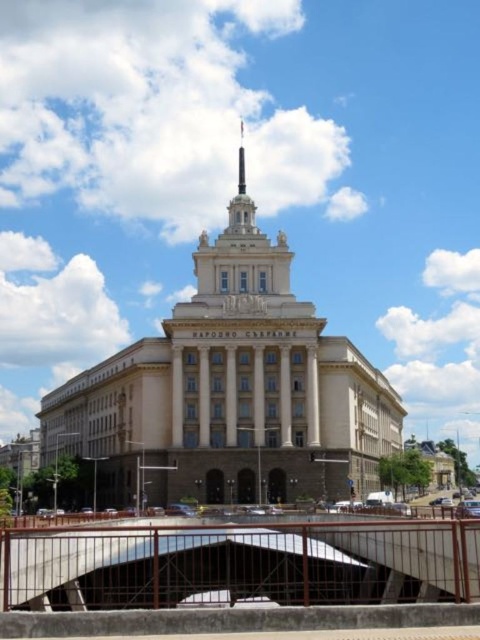
Can you confirm if beige stone building at center is shorter than polished gold spire at center top?

No, beige stone building at center is not shorter than polished gold spire at center top.

Between beige stone building at center and polished gold spire at center top, which one appears on the right side from the viewer's perspective?

From the viewer's perspective, beige stone building at center appears more on the right side.

Which is in front, point (223, 310) or point (241, 160)?

Positioned in front is point (223, 310).

Find the location of a particular element. beige stone building at center is located at coordinates (230, 392).

Who is more distant from viewer, (375, 554) or (240, 131)?

Point (240, 131)

Who is lower down, brown metal bridge at lower center or polished gold spire at center top?

brown metal bridge at lower center is lower down.

Which is in front, point (324, 577) or point (244, 188)?

Positioned in front is point (324, 577).

Find the location of a particular element. Image resolution: width=480 pixels, height=640 pixels. brown metal bridge at lower center is located at coordinates (240, 563).

Between beige stone building at center and brown metal bridge at lower center, which one has less height?

With less height is brown metal bridge at lower center.

This screenshot has width=480, height=640. Describe the element at coordinates (230, 392) in the screenshot. I see `beige stone building at center` at that location.

What do you see at coordinates (230, 392) in the screenshot? Image resolution: width=480 pixels, height=640 pixels. I see `beige stone building at center` at bounding box center [230, 392].

Locate an element on the screen. The image size is (480, 640). beige stone building at center is located at coordinates (x=230, y=392).